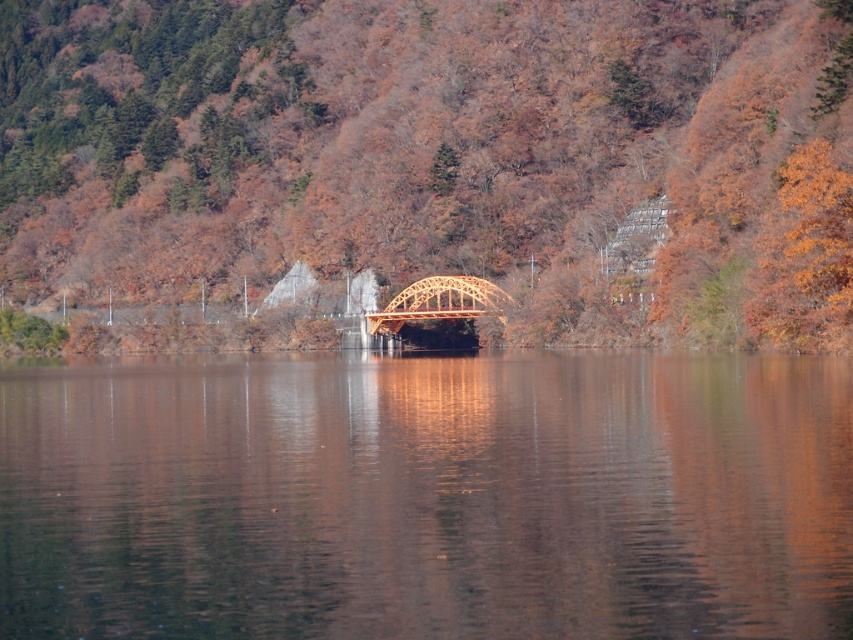
Question: Can you confirm if orange wood bridge at center is positioned above transparent water at center?

Choices:
 (A) no
 (B) yes

Answer: (B)

Question: Can you confirm if transparent water at center is bigger than wooden bridge at center?

Choices:
 (A) no
 (B) yes

Answer: (B)

Question: Which object appears farthest from the camera in this image?

Choices:
 (A) transparent water at center
 (B) wooden bridge at center

Answer: (B)

Question: Which of these objects is positioned farthest from the wooden bridge at center?

Choices:
 (A) transparent water at center
 (B) orange wood bridge at center

Answer: (A)

Question: Is transparent water at center wider than wooden bridge at center?

Choices:
 (A) no
 (B) yes

Answer: (B)

Question: Which point is closer to the camera?

Choices:
 (A) (451, 298)
 (B) (387, 632)
 (C) (305, 99)

Answer: (B)